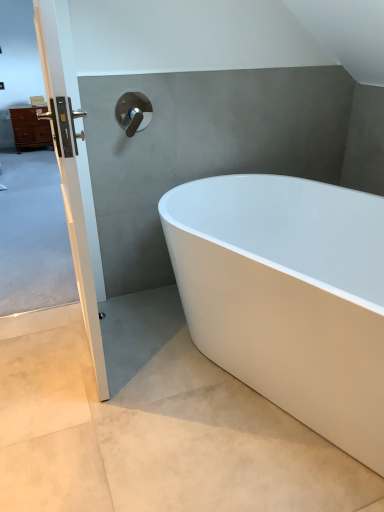
This screenshot has height=512, width=384. Find the location of `spots to the right of white glossy door handle at left`. spots to the right of white glossy door handle at left is located at coordinates (162, 353).